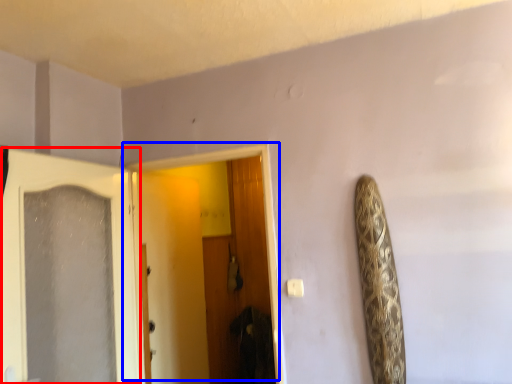
Question: Which point is closer to the camera, door (highlighted by a red box) or door (highlighted by a blue box)?

Choices:
 (A) door
 (B) door

Answer: (A)